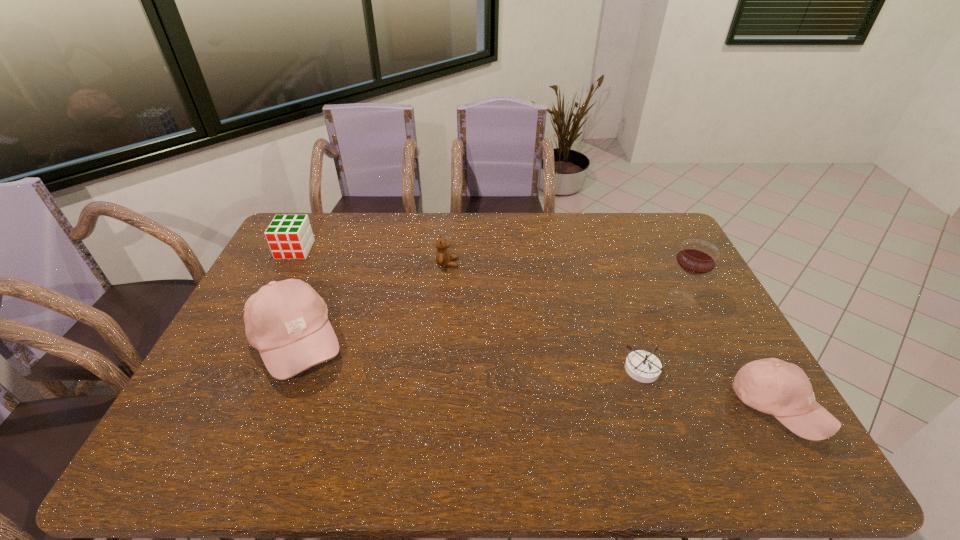
At what (x,y) coordinates should I click in order to perform the action: click on the left baseball cap. Please return your answer as a coordinate pair (x, y). This screenshot has height=540, width=960. Looking at the image, I should click on (287, 321).

Identify the location of the right baseball cap. Image resolution: width=960 pixels, height=540 pixels. (773, 386).

You are a GUI agent. You are given a task and a screenshot of the screen. Output one action in this format:
    pyautogui.click(x=<x>, y=<y>)
    Task: Click on the teddy bear
    Image resolution: width=960 pixels, height=540 pixels.
    Given the screenshot: What is the action you would take?
    [x=443, y=258]

Find the location of `the third object from right to left`. the third object from right to left is located at coordinates (645, 367).

This screenshot has width=960, height=540. Find the location of `the shortest object`. the shortest object is located at coordinates [x=645, y=367].

This screenshot has width=960, height=540. Identify the location of cube. (289, 236).

Locate an element on the screen. The width and height of the screenshot is (960, 540). wineglass is located at coordinates point(696,257).

Where is `free space located 0.140m on the front-facing side of the left baseball cap`? The image size is (960, 540). free space located 0.140m on the front-facing side of the left baseball cap is located at coordinates (397, 343).

I want to click on free space located on the front-facing side of the third object from left to right, so [519, 264].

Locate an element on the screen. The height and width of the screenshot is (540, 960). vacant space located 0.210m on the left of the compass is located at coordinates pyautogui.click(x=546, y=368).